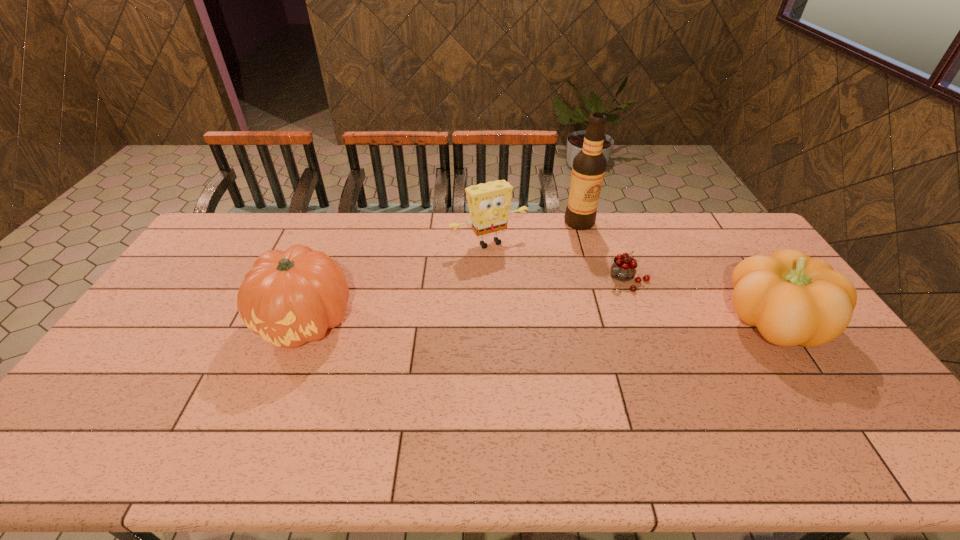
The width and height of the screenshot is (960, 540). Identify the location of vacant space at the near edge of the desktop. (739, 390).

At what (x,y) coordinates should I click in order to perform the action: click on vacant region at the left edge of the desktop. Please return your answer as a coordinate pair (x, y). Looking at the image, I should click on (228, 268).

Image resolution: width=960 pixels, height=540 pixels. I want to click on vacant space at the right edge, so click(749, 254).

Where is `free space at the near left corner`? This screenshot has height=540, width=960. free space at the near left corner is located at coordinates (85, 408).

Where is `vacant region at the far right corner of the desktop`? The height and width of the screenshot is (540, 960). vacant region at the far right corner of the desktop is located at coordinates (715, 232).

Find the location of a particular element. The width and height of the screenshot is (960, 540). vacant area that lies between the sponge and the left pumpkin is located at coordinates (397, 282).

This screenshot has height=540, width=960. Identify the location of free space that is in between the tallest object and the leftmost object. (443, 272).

Find the location of a particular element. vacant area between the rightmost object and the left pumpkin is located at coordinates (540, 322).

This screenshot has width=960, height=540. In order to click on blank region between the right pumpkin and the leftmost object in this screenshot , I will do `click(540, 322)`.

Find the location of `empty location between the sponge and the leftmost object`. empty location between the sponge and the leftmost object is located at coordinates (397, 282).